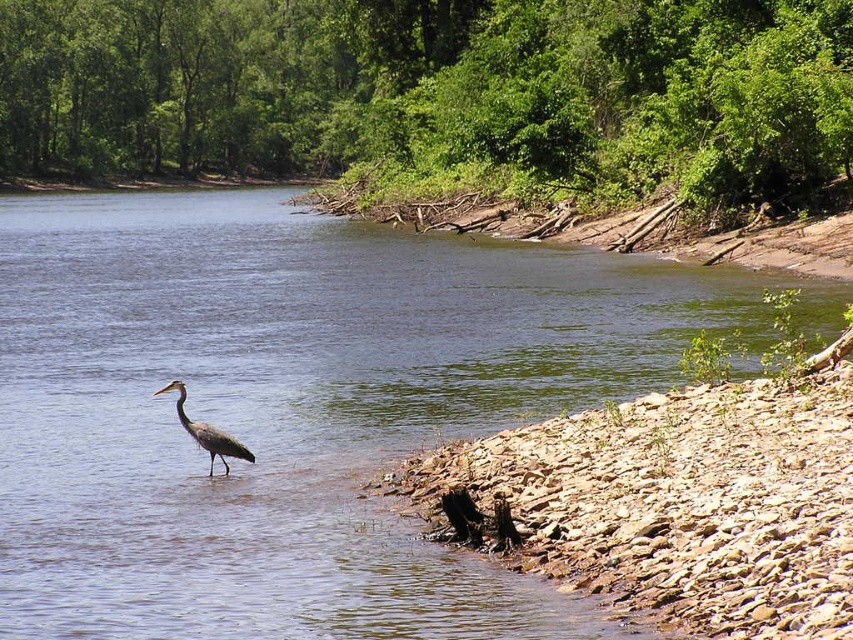
Question: Is blue water at center to the right of gray matte bird at center from the viewer's perspective?

Choices:
 (A) no
 (B) yes

Answer: (B)

Question: Can you confirm if blue water at center is positioned below gray matte bird at center?

Choices:
 (A) no
 (B) yes

Answer: (A)

Question: Does blue water at center appear under gray matte bird at center?

Choices:
 (A) yes
 (B) no

Answer: (B)